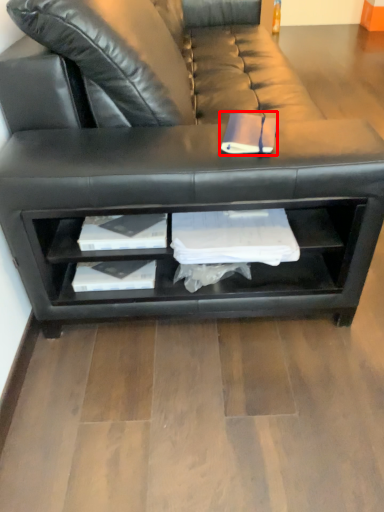
Question: From the image's perspective, where is book (annotated by the red box) located in relation to studio couch in the image?

Choices:
 (A) above
 (B) below

Answer: (B)